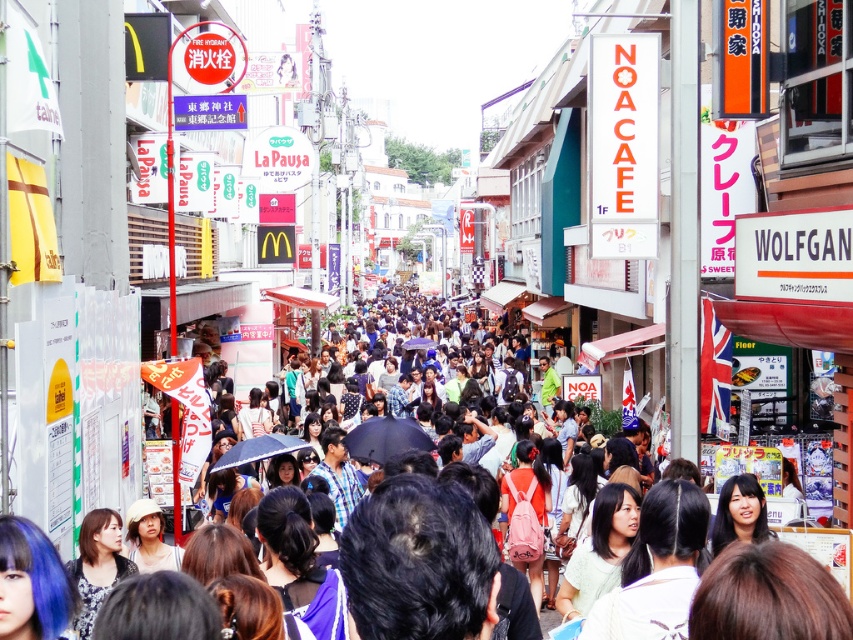
You are a street performer in the middle of the crowded urban street scene. You notice two umbrellas at the center of the image. Which one is closer to you, the matte black umbrella at center or the transparent blue umbrella at center?

The matte black umbrella at center is closer to you because it is in front of the transparent blue umbrella at center.

You are standing on an urban street in Japan and want to take a photo of both the NOA CAFE and La Pausa signs. You notice two points marked on your map at coordinates point (x=370, y=461) and point (x=258, y=452). Which point should you stand at to ensure both signs are in your frame without needing to move your camera position?

You should stand at point (x=258, y=452) because it is closer to the camera, allowing both the NOA CAFE and La Pausa signs to be in frame without needing to adjust your camera position.

You are standing at the origin point of the coordinate system in the image and want to reach the black matte umbrella at center. Which direction should you move in to get there?

The black matte umbrella at center is located at point (386,438), so you should move towards the northeast direction to reach it.